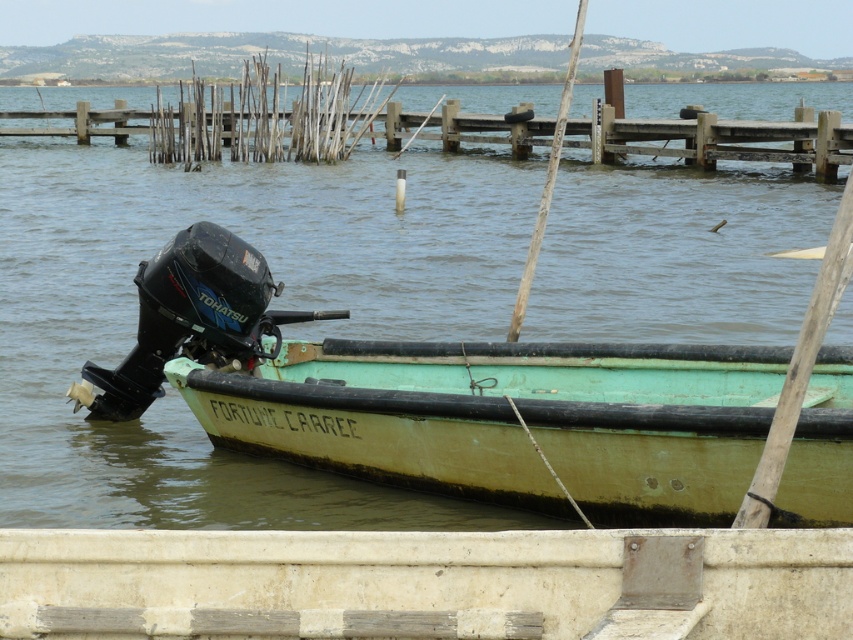
Does green matte boat at center appear on the left side of wooden dock at upper center?

Yes, green matte boat at center is to the left of wooden dock at upper center.

Is point (432, 385) behind point (456, 120)?

No, it is not.

Between point (608, 426) and point (515, 147), which one is positioned behind?

The point (515, 147) is behind.

At what (x,y) coordinates should I click in order to perform the action: click on green matte boat at center. Please return your answer as a coordinate pair (x, y). This screenshot has width=853, height=640. Looking at the image, I should click on (445, 397).